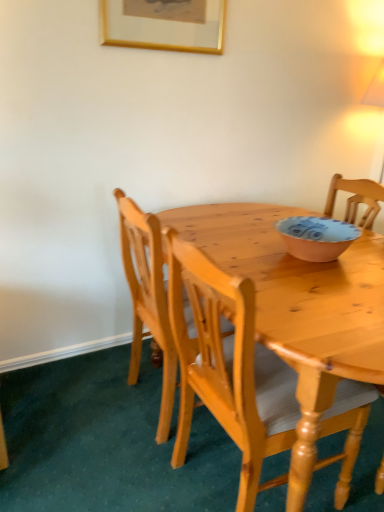
In order to click on vacant space positioned to the left of light brown wooden chair at center, acting as the 1th chair starting from the back in this screenshot , I will do `click(84, 404)`.